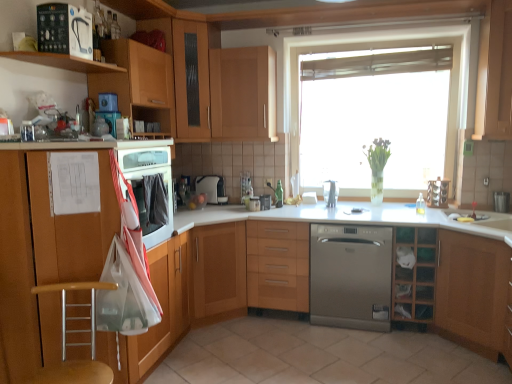
Question: Considering the relative sizes of wooden cabinet at lower right, the 2th shelf when ordered from left to right, and wooden cabinet at center, acting as the 4th cabinetry starting from the left, in the image provided, is wooden cabinet at lower right, the 2th shelf when ordered from left to right, thinner than wooden cabinet at center, acting as the 4th cabinetry starting from the left,?

Choices:
 (A) yes
 (B) no

Answer: (A)

Question: From the image's perspective, is wooden cabinet at lower right, positioned as the 1th shelf in right-to-left order, above wooden cabinet at center, the 5th cabinetry positioned from the right?

Choices:
 (A) yes
 (B) no

Answer: (A)

Question: Is wooden cabinet at lower right, the second shelf positioned from the top, with wooden cabinet at center, acting as the 4th cabinetry starting from the left?

Choices:
 (A) no
 (B) yes

Answer: (A)

Question: Does wooden cabinet at lower right, which is the 1th shelf in back-to-front order, appear on the right side of wooden cabinet at center, acting as the 4th cabinetry starting from the left?

Choices:
 (A) no
 (B) yes

Answer: (B)

Question: Is wooden cabinet at lower right, the 1th shelf ordered from the bottom, looking in the opposite direction of wooden cabinet at center, the 5th cabinetry positioned from the right?

Choices:
 (A) yes
 (B) no

Answer: (B)

Question: From a real-world perspective, is wooden cabinet at lower right, positioned as the 1th shelf in right-to-left order, over wooden cabinet at center, acting as the 4th cabinetry starting from the left?

Choices:
 (A) yes
 (B) no

Answer: (A)

Question: Considering the relative sizes of black plastic water filter at upper left, which ranks as the 2th kitchen appliance in back-to-front order, and matte wood cabinet at left, which appears as the 1th cabinetry when viewed from the left, in the image provided, is black plastic water filter at upper left, which ranks as the 2th kitchen appliance in back-to-front order, bigger than matte wood cabinet at left, which appears as the 1th cabinetry when viewed from the left,?

Choices:
 (A) yes
 (B) no

Answer: (B)

Question: Is black plastic water filter at upper left, the first kitchen appliance viewed from the top, smaller than matte wood cabinet at left, which appears as the 1th cabinetry when viewed from the left?

Choices:
 (A) no
 (B) yes

Answer: (B)

Question: From a real-world perspective, is black plastic water filter at upper left, the first kitchen appliance viewed from the top, over matte wood cabinet at left, which is counted as the 8th cabinetry, starting from the right?

Choices:
 (A) no
 (B) yes

Answer: (B)

Question: Is black plastic water filter at upper left, which ranks as the 2th kitchen appliance in back-to-front order, not inside matte wood cabinet at left, which is counted as the 8th cabinetry, starting from the right?

Choices:
 (A) yes
 (B) no

Answer: (A)

Question: Would you say matte wood cabinet at left, which appears as the 1th cabinetry when viewed from the left, is part of black plastic water filter at upper left, the second kitchen appliance when ordered from right to left,'s contents?

Choices:
 (A) no
 (B) yes

Answer: (A)

Question: Considering the relative sizes of black plastic water filter at upper left, which ranks as the 2th kitchen appliance in back-to-front order, and matte wood cabinet at left, which is counted as the 8th cabinetry, starting from the right, in the image provided, is black plastic water filter at upper left, which ranks as the 2th kitchen appliance in back-to-front order, shorter than matte wood cabinet at left, which is counted as the 8th cabinetry, starting from the right,?

Choices:
 (A) yes
 (B) no

Answer: (A)

Question: Could wooden cabinet at upper center, arranged as the fourth cabinetry when viewed from the right, be considered to be inside wooden seat at lower left?

Choices:
 (A) no
 (B) yes

Answer: (A)